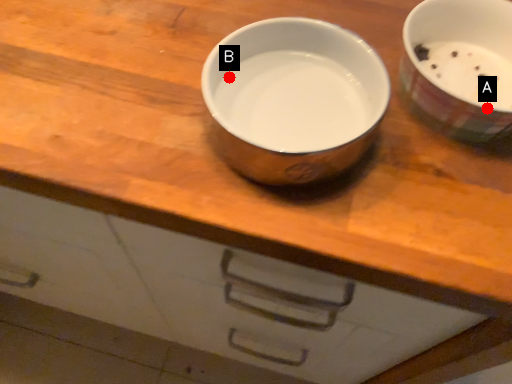
Question: Two points are circled on the image, labeled by A and B beside each circle. Which point is further to the camera?

Choices:
 (A) A is further
 (B) B is further

Answer: (B)